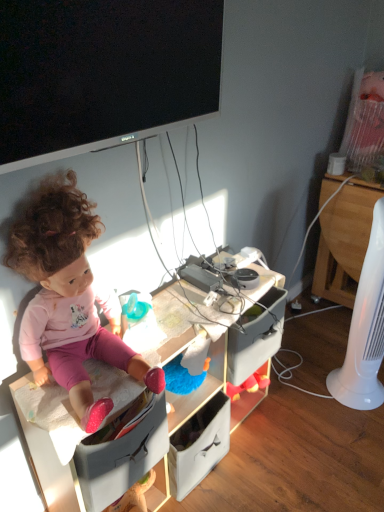
At what (x,y) coordinates should I click in order to perform the action: click on pink fabric doll at left. Please return your answer as a coordinate pair (x, y). This screenshot has width=384, height=512. Looking at the image, I should click on coord(69,298).

You are a GUI agent. You are given a task and a screenshot of the screen. Output one action in this format:
    pyautogui.click(x=<x>, y=<y>)
    Task: Click on the wooden at right
    This screenshot has width=384, height=512.
    Given the screenshot: What is the action you would take?
    pyautogui.click(x=344, y=241)

In terms of width, does matte plastic desk at center look wider or thinner when compared to pink fabric doll at left?

Considering their sizes, matte plastic desk at center looks slimmer than pink fabric doll at left.

Considering the relative positions of matte plastic desk at center and pink fabric doll at left in the image provided, is matte plastic desk at center to the left of pink fabric doll at left from the viewer's perspective?

No.

From a real-world perspective, is matte plastic desk at center positioned under pink fabric doll at left based on gravity?

Yes.

Does wooden at right have a greater width compared to pink fabric doll at left?

Indeed, wooden at right has a greater width compared to pink fabric doll at left.

Between wooden at right and pink fabric doll at left, which one appears on the right side from the viewer's perspective?

From the viewer's perspective, wooden at right appears more on the right side.

Where is `person above the wooden at right (from a real-world perspective)`? Image resolution: width=384 pixels, height=512 pixels. person above the wooden at right (from a real-world perspective) is located at coordinates (69, 298).

From a real-world perspective, does wooden at right sit lower than pink fabric doll at left?

Correct, in the physical world, wooden at right is lower than pink fabric doll at left.

Is wooden at right surrounding matte plastic desk at center?

No, matte plastic desk at center is located outside of wooden at right.

Can you confirm if wooden at right is shorter than matte plastic desk at center?

Incorrect, the height of wooden at right does not fall short of that of matte plastic desk at center.

Which of these two, wooden at right or matte plastic desk at center, is thinner?

Thinner between the two is matte plastic desk at center.

Measure the distance between wooden at right and matte plastic desk at center.

wooden at right and matte plastic desk at center are 36.31 inches apart from each other.

This screenshot has width=384, height=512. What are the coordinates of `desk that appears on the left of white plastic fan at right` in the screenshot? It's located at (48, 439).

From a real-world perspective, relative to matte plastic desk at center, is white plastic fan at right vertically above or below?

white plastic fan at right is above matte plastic desk at center.

Between white plastic fan at right and matte plastic desk at center, which one appears on the left side from the viewer's perspective?

From the viewer's perspective, matte plastic desk at center appears more on the left side.

Is white plastic fan at right placed right next to black glossy flat-screen tv at upper center?

white plastic fan at right and black glossy flat-screen tv at upper center are clearly separated.

Consider the image. Which point is more distant from viewer, (358, 291) or (37, 35)?

Positioned behind is point (358, 291).

Consider the image. From the image's perspective, would you say white plastic fan at right is shown under black glossy flat-screen tv at upper center?

Yes, from the image's perspective, white plastic fan at right is below black glossy flat-screen tv at upper center.

Between white plastic fan at right and black glossy flat-screen tv at upper center, which one has smaller size?

black glossy flat-screen tv at upper center.

Which object is wider, white plastic fan at right or wooden at right?

wooden at right.

Is white plastic fan at right with wooden at right?

No, white plastic fan at right is not making contact with wooden at right.

This screenshot has height=512, width=384. In order to click on computer desk behind the white plastic fan at right in this screenshot , I will do `click(344, 241)`.

Is white plastic fan at right oriented towards wooden at right?

No, white plastic fan at right is not oriented towards wooden at right.

From the image's perspective, between pink fabric doll at left and wooden at right, which one is located above?

wooden at right, from the image's perspective.

Between pink fabric doll at left and wooden at right, which one has smaller width?

pink fabric doll at left.

Is the surface of pink fabric doll at left in direct contact with wooden at right?

No.

Is pink fabric doll at left aimed at wooden at right?

No, pink fabric doll at left is not facing towards wooden at right.

At what (x,y) coordinates should I click in order to perform the action: click on person located above the matte plastic desk at center (from the image's perspective). Please return your answer as a coordinate pair (x, y). Looking at the image, I should click on (69, 298).

Where is `computer desk behind the pink fabric doll at left`? The image size is (384, 512). computer desk behind the pink fabric doll at left is located at coordinates (344, 241).

Based on their spatial positions, is white plastic fan at right or matte plastic desk at center further from wooden at right?

The object further to wooden at right is matte plastic desk at center.

Estimate the real-world distances between objects in this image. Which object is closer to white plastic fan at right, black glossy flat-screen tv at upper center or wooden at right?

wooden at right lies closer to white plastic fan at right than the other object.

Which object lies nearer to the anchor point pink fabric doll at left, white plastic fan at right or matte plastic desk at center?

The object closer to pink fabric doll at left is matte plastic desk at center.

Looking at the image, which one is located closer to black glossy flat-screen tv at upper center, white plastic fan at right or matte plastic desk at center?

matte plastic desk at center is positioned closer to the anchor black glossy flat-screen tv at upper center.

When comparing their distances from wooden at right, does white plastic fan at right or pink fabric doll at left seem further?

pink fabric doll at left lies further to wooden at right than the other object.

Which object lies nearer to the anchor point white plastic fan at right, matte plastic desk at center or pink fabric doll at left?

matte plastic desk at center is closer to white plastic fan at right.

Based on the photo, from the image, which object appears to be nearer to wooden at right, black glossy flat-screen tv at upper center or matte plastic desk at center?

matte plastic desk at center lies closer to wooden at right than the other object.

Looking at the image, which one is located closer to pink fabric doll at left, matte plastic desk at center or black glossy flat-screen tv at upper center?

Based on the image, matte plastic desk at center appears to be nearer to pink fabric doll at left.

This screenshot has height=512, width=384. I want to click on desk between pink fabric doll at left and white plastic fan at right, so click(x=48, y=439).

This screenshot has width=384, height=512. I want to click on fan situated between pink fabric doll at left and wooden at right from left to right, so click(365, 330).

Find the location of a particular element. Image resolution: width=384 pixels, height=512 pixels. person between black glossy flat-screen tv at upper center and matte plastic desk at center in the up-down direction is located at coordinates (69, 298).

In order to click on desk situated between black glossy flat-screen tv at upper center and white plastic fan at right from left to right in this screenshot , I will do `click(48, 439)`.